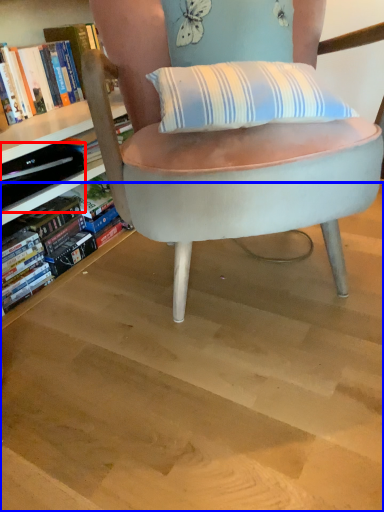
Question: Which point is closer to the camera, paperback book (highlighted by a red box) or stairwell (highlighted by a blue box)?

Choices:
 (A) paperback book
 (B) stairwell

Answer: (B)